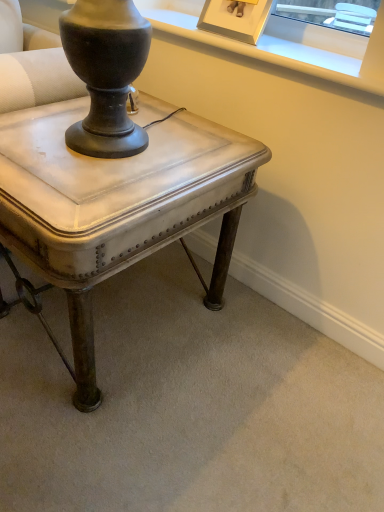
Question: In terms of height, does metallic silver table at center look taller or shorter compared to gold-framed picture at upper center?

Choices:
 (A) tall
 (B) short

Answer: (A)

Question: From the image's perspective, is metallic silver table at center positioned above or below gold-framed picture at upper center?

Choices:
 (A) below
 (B) above

Answer: (A)

Question: Is metallic silver table at center wider or thinner than gold-framed picture at upper center?

Choices:
 (A) wide
 (B) thin

Answer: (A)

Question: From the image's perspective, is gold-framed picture at upper center positioned above or below metallic silver table at center?

Choices:
 (A) below
 (B) above

Answer: (B)

Question: Is gold-framed picture at upper center taller or shorter than metallic silver table at center?

Choices:
 (A) tall
 (B) short

Answer: (B)

Question: Looking at their shapes, would you say gold-framed picture at upper center is wider or thinner than metallic silver table at center?

Choices:
 (A) wide
 (B) thin

Answer: (B)

Question: From a real-world perspective, is gold-framed picture at upper center positioned above or below metallic silver table at center?

Choices:
 (A) below
 (B) above

Answer: (B)